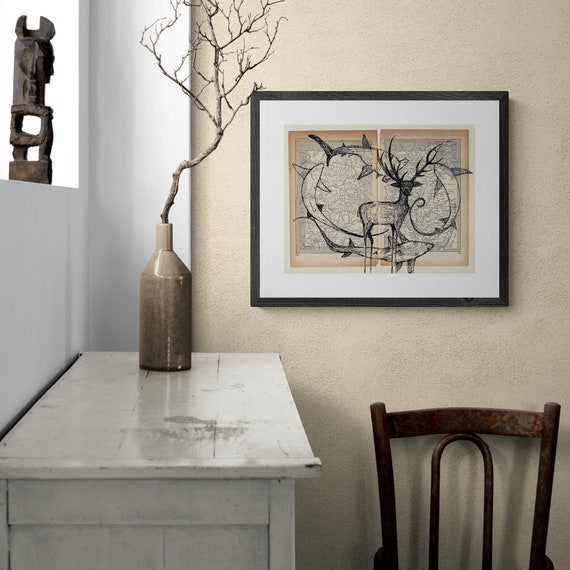
Find the location of a particular element. The image size is (570, 570). 1 picture frame is located at coordinates (500, 299).